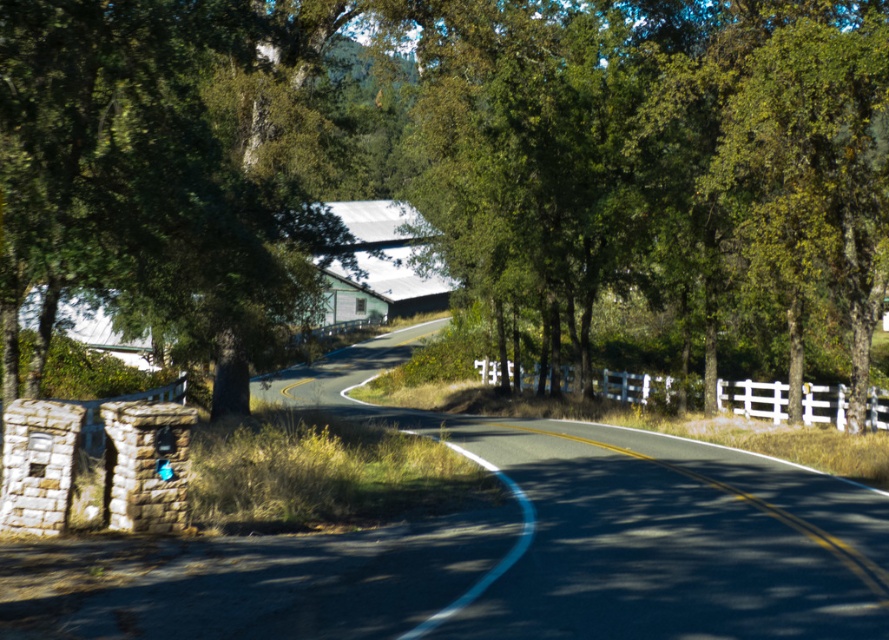
Can you confirm if green leafy tree at center is shorter than white wooden fence at center?

No.

Can you confirm if green leafy tree at center is bigger than white wooden fence at center?

Indeed, green leafy tree at center has a larger size compared to white wooden fence at center.

Is point (655, 256) positioned before point (818, 417)?

That is True.

The height and width of the screenshot is (640, 889). Find the location of `green leafy tree at center`. green leafy tree at center is located at coordinates (467, 157).